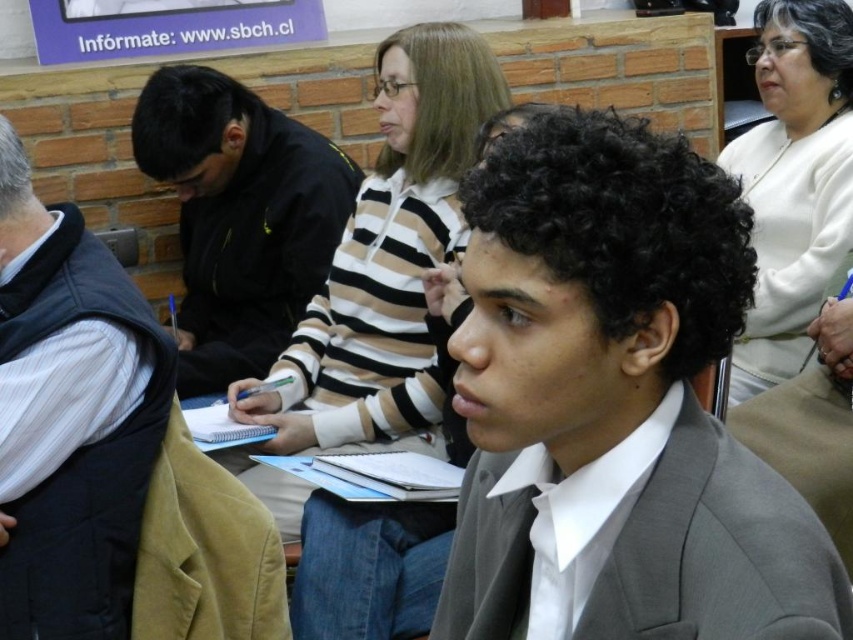
You are standing in the classroom and want to reach a specific point marked as point (x=378, y=358). If you can move forward 5 feet, will you reach the point?

The distance between you and point (x=378, y=358) is 7.46 feet. Since you can only move forward 5 feet, you will not reach the point.

You are organizing a clothing donation drive and need to determine which item takes up more space. Which of the two items, the striped sweater at center or the black jacket at center, is wider?

The striped sweater at center is wider than the black jacket at center.

You are organizing a clothing donation drive and need to determine which item takes up more space when folded. Based on the image, which of the two items, the black jacket at center or the white soft sweater at upper right, would require more storage space?

The black jacket at center has a greater width than the white soft sweater at upper right, so it would require more storage space when folded.